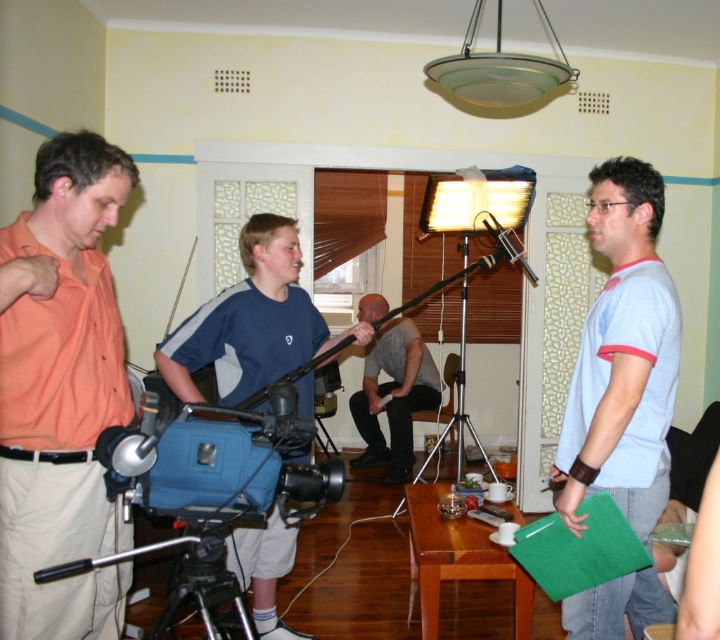
Question: Among these objects, which one is farthest from the camera?

Choices:
 (A) orange cotton shirt at left
 (B) silver metallic tripod at center
 (C) blue fabric video camera at center
 (D) light blue t-shirt at right

Answer: (B)

Question: Which of the following is the closest to the observer?

Choices:
 (A) orange cotton shirt at left
 (B) blue fabric camera at center

Answer: (A)

Question: Does orange cotton shirt at left have a larger size compared to gray cotton shirt at center?

Choices:
 (A) yes
 (B) no

Answer: (B)

Question: Considering the relative positions of blue fabric camera at center and silver metallic tripod at center in the image provided, where is blue fabric camera at center located with respect to silver metallic tripod at center?

Choices:
 (A) right
 (B) left

Answer: (B)

Question: Which of the following is the farthest from the observer?

Choices:
 (A) silver metallic tripod at center
 (B) blue fabric camera at center

Answer: (A)

Question: Is light blue t-shirt at right wider than silver metallic tripod at center?

Choices:
 (A) yes
 (B) no

Answer: (B)